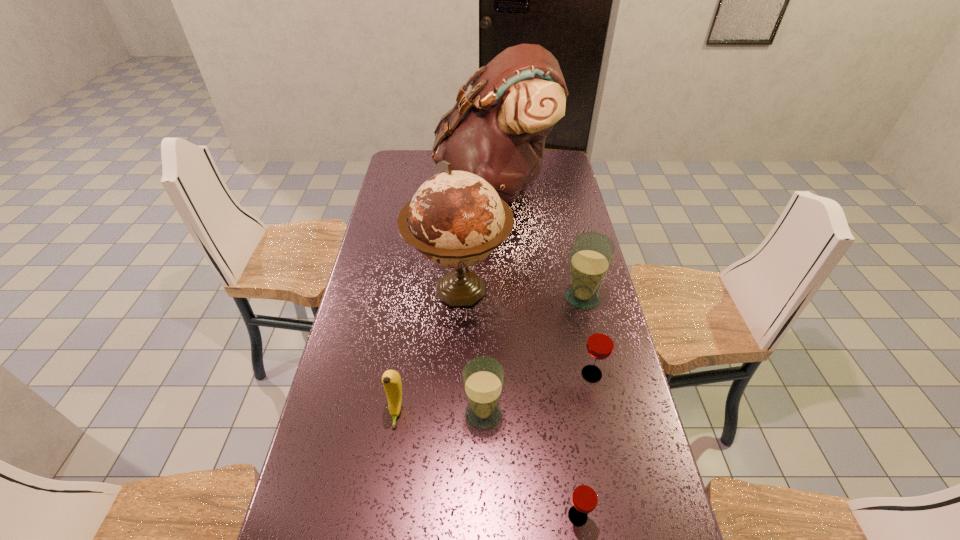
Where is `the farthest object`? the farthest object is located at coordinates (497, 131).

Where is `the tallest object`? The width and height of the screenshot is (960, 540). the tallest object is located at coordinates (497, 131).

You are a GUI agent. You are given a task and a screenshot of the screen. Output one action in this format:
    pyautogui.click(x=<x>, y=<y>)
    Task: Click on the globe
    The width and height of the screenshot is (960, 540).
    Given the screenshot: What is the action you would take?
    pyautogui.click(x=456, y=219)

At what (x,y) coordinates should I click in order to perform the action: click on the tallest glass. Please return your answer as a coordinate pair (x, y). Looking at the image, I should click on (591, 254).

What are the coordinates of `the farthest glass` in the screenshot? It's located at (591, 254).

What are the coordinates of `the right red glass` in the screenshot? It's located at (600, 344).

At what (x,y) coordinates should I click in order to perform the action: click on the third nearest glass. Please return your answer as a coordinate pair (x, y). This screenshot has width=960, height=540. Looking at the image, I should click on (600, 344).

This screenshot has height=540, width=960. What are the coordinates of `the nearer blue glass` in the screenshot? It's located at (483, 378).

Where is `the third farthest glass`? The width and height of the screenshot is (960, 540). the third farthest glass is located at coordinates (x=483, y=378).

Identify the location of banana. The width and height of the screenshot is (960, 540). (391, 380).